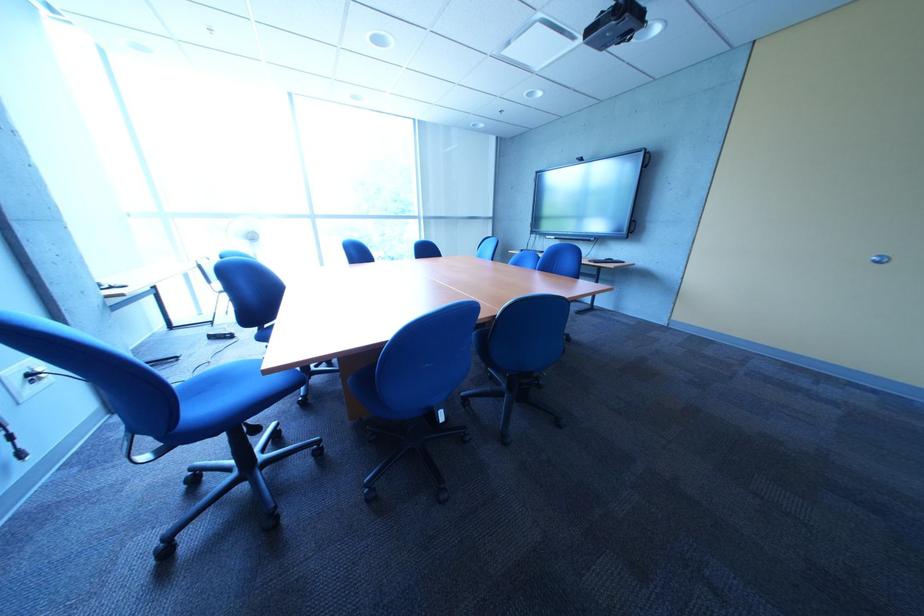
You are a GUI agent. You are given a task and a screenshot of the screen. Output one action in this format:
    pyautogui.click(x=<x>, y=<y>)
    Task: Click on the power outlet
    The height and width of the screenshot is (616, 924).
    Given the screenshot: What is the action you would take?
    pyautogui.click(x=23, y=379)